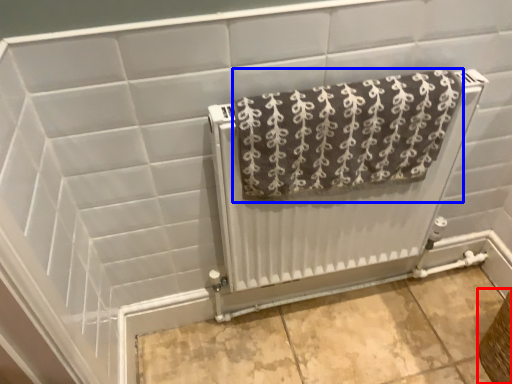
Question: Among these objects, which one is farthest to the camera, basket (highlighted by a red box) or towel (highlighted by a blue box)?

Choices:
 (A) basket
 (B) towel

Answer: (A)